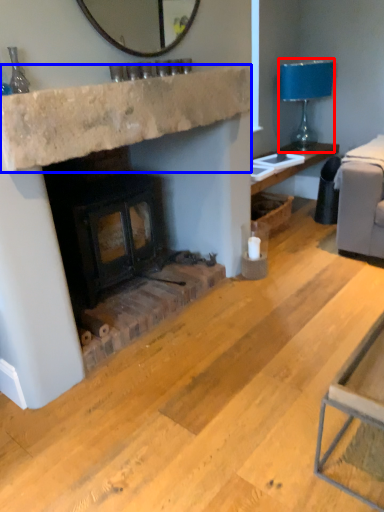
Question: Which object appears farthest to the camera in this image, lamp (highlighted by a red box) or counter top (highlighted by a blue box)?

Choices:
 (A) lamp
 (B) counter top

Answer: (A)